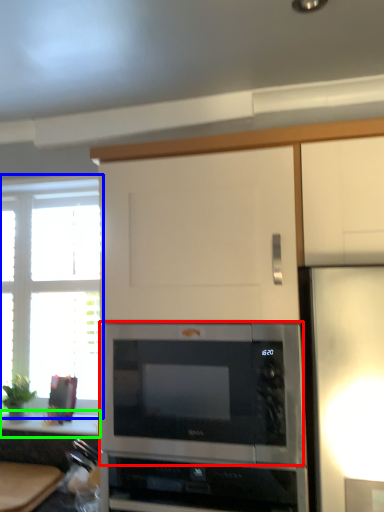
Question: Which object is positioned closest to microwave oven (highlighted by a red box)? Select from window (highlighted by a blue box) and counter top (highlighted by a green box).

Choices:
 (A) window
 (B) counter top

Answer: (B)